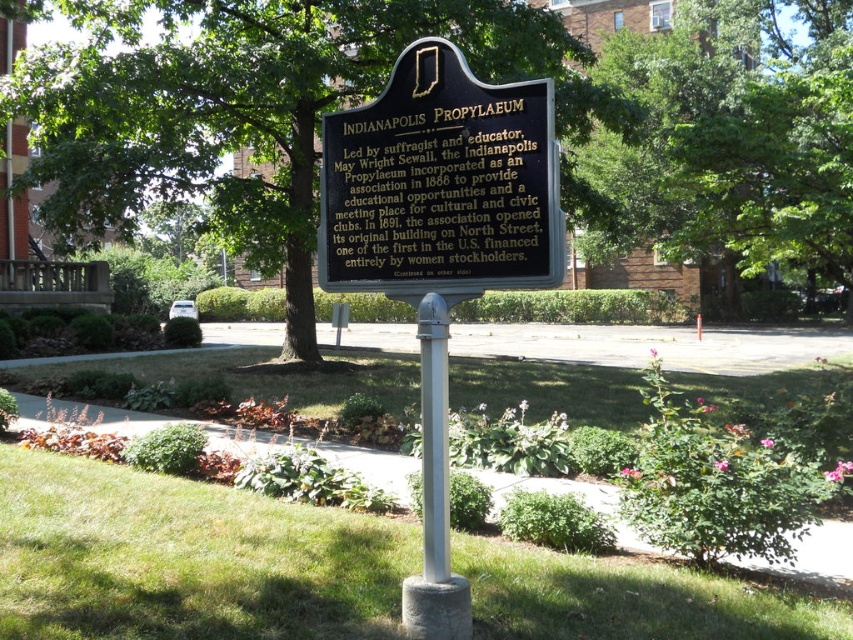
You are standing in front of the Indianapolis Propylaeum historical marker sign. You notice two points on the sign labeled as point 1 at coordinates point [386,276] and point 2 at coordinates point [840,35]. Which point is closer to your eyes?

Point [386,276] is closer to the camera than point [840,35], so point 1 is closer to your eyes.

You are a visitor at the Indianapolis Propylaeum historical site. You notice two plaques at the center of the scene. Which one is positioned lower between the black polished stone plaque at center and the black metal plaque at center?

The black polished stone plaque at center is positioned lower than the black metal plaque at center.